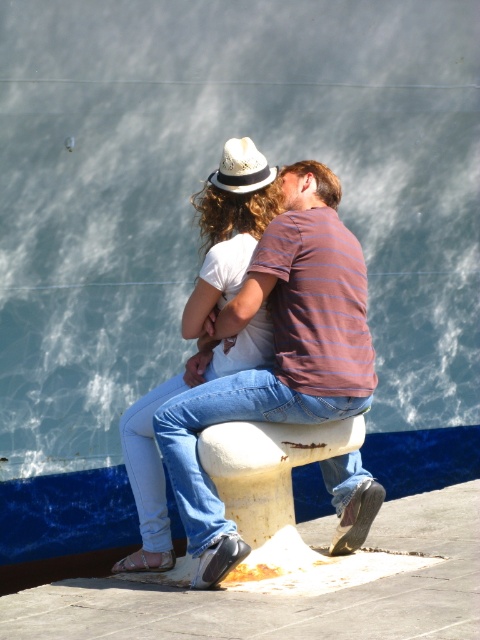
Question: Observing the image, what is the correct spatial positioning of striped cotton shirt at center in reference to white matte hat at upper center?

Choices:
 (A) left
 (B) right

Answer: (B)

Question: Which object is closer to the camera taking this photo?

Choices:
 (A) white matte hat at upper center
 (B) striped cotton shirt at center

Answer: (B)

Question: Is striped cotton shirt at center below white textured cowboy hat at center?

Choices:
 (A) no
 (B) yes

Answer: (B)

Question: Is striped cotton shirt at center to the right of white matte hat at upper center from the viewer's perspective?

Choices:
 (A) yes
 (B) no

Answer: (A)

Question: Which point appears closest to the camera in this image?

Choices:
 (A) (231, 168)
 (B) (171, 442)
 (C) (144, 397)

Answer: (B)

Question: Which of the following is the closest to the observer?

Choices:
 (A) white matte hat at upper center
 (B) striped cotton shirt at center
 (C) white textured cowboy hat at center

Answer: (B)